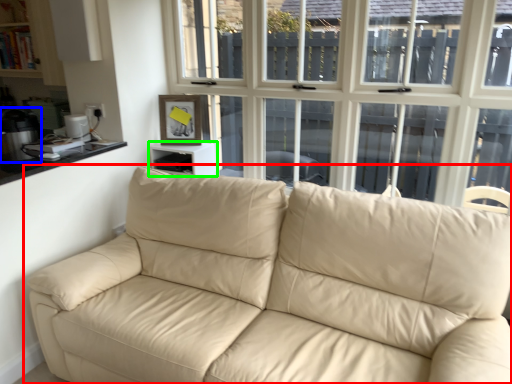
Question: Which object is positioned farthest from studio couch (highlighted by a red box)? Select from appliance (highlighted by a blue box) and table (highlighted by a green box).

Choices:
 (A) appliance
 (B) table

Answer: (A)